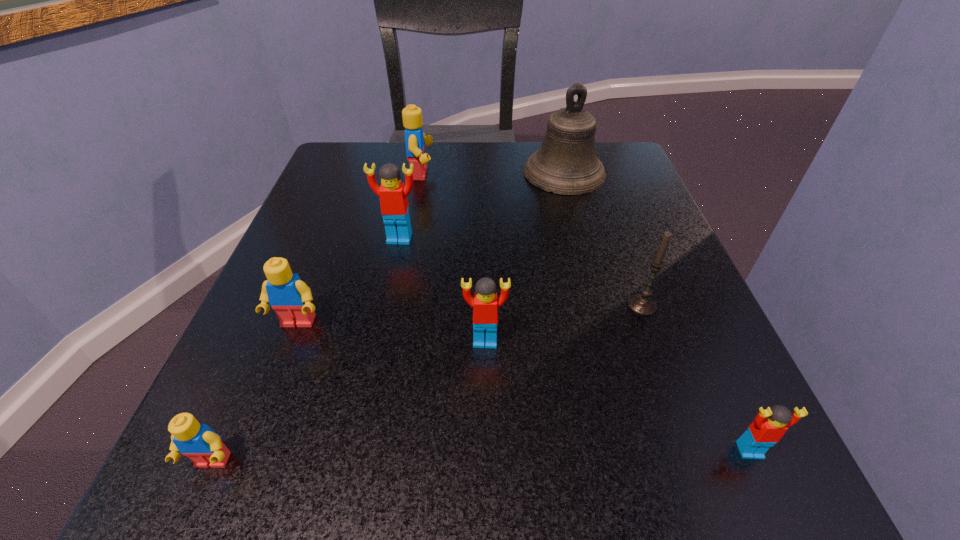
Where is `bell that is at the right edge`? bell that is at the right edge is located at coordinates (566, 163).

Find the location of a particular element. The width and height of the screenshot is (960, 540). candle at the right edge is located at coordinates (643, 304).

You are a GUI agent. You are given a task and a screenshot of the screen. Output one action in this format:
    pyautogui.click(x=<x>, y=<y>)
    Task: Click on the Lego that is at the right edge
    The image size is (960, 540).
    Given the screenshot: What is the action you would take?
    pyautogui.click(x=769, y=425)

Where is `object located in the near left corner section of the desktop`? object located in the near left corner section of the desktop is located at coordinates (203, 446).

The height and width of the screenshot is (540, 960). Identify the location of object present at the far right corner. (566, 163).

This screenshot has width=960, height=540. I want to click on object that is at the near right corner, so click(x=769, y=425).

The height and width of the screenshot is (540, 960). I want to click on vacant space at the far edge, so click(x=444, y=185).

Locate an element on the screen. This screenshot has width=960, height=540. free location at the near edge is located at coordinates tap(540, 484).

In order to click on vacant space at the left edge of the desktop in this screenshot , I will do `click(355, 218)`.

The height and width of the screenshot is (540, 960). In order to click on vacant region at the right edge of the desktop in this screenshot , I will do `click(616, 372)`.